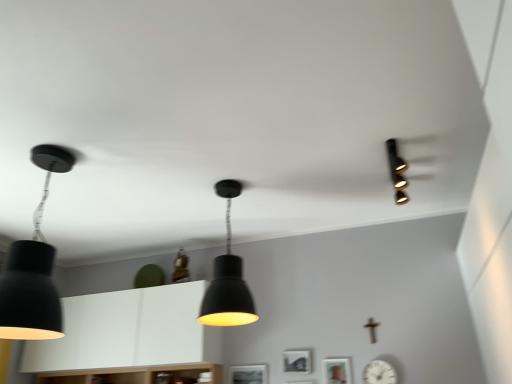
Question: Are matte black picture frame at center, the third picture frame in the right-to-left sequence, and matte black lampshade at center, which is the second lamp in right-to-left order, located far from each other?

Choices:
 (A) yes
 (B) no

Answer: (A)

Question: Is matte black picture frame at center, positioned as the 1th picture frame in left-to-right order, at the left side of matte black lampshade at center, acting as the second lamp starting from the left?

Choices:
 (A) no
 (B) yes

Answer: (A)

Question: Does matte black picture frame at center, positioned as the 1th picture frame in left-to-right order, have a greater width compared to matte black lampshade at center, acting as the second lamp starting from the left?

Choices:
 (A) yes
 (B) no

Answer: (B)

Question: Is matte black picture frame at center, the third picture frame in the right-to-left sequence, outside matte black lampshade at center, acting as the second lamp starting from the left?

Choices:
 (A) yes
 (B) no

Answer: (A)

Question: Is matte black picture frame at center, the third picture frame in the right-to-left sequence, facing away from matte black lampshade at center, acting as the second lamp starting from the left?

Choices:
 (A) yes
 (B) no

Answer: (B)

Question: From a real-world perspective, is matte black picture frame at center, the third picture frame in the right-to-left sequence, under matte black lampshade at center, which is the second lamp in right-to-left order?

Choices:
 (A) no
 (B) yes

Answer: (B)

Question: Is matte black picture frame at center, positioned as the 1th picture frame in left-to-right order, wider than white matte cabinet at center?

Choices:
 (A) yes
 (B) no

Answer: (B)

Question: Is matte black picture frame at center, positioned as the 1th picture frame in left-to-right order, oriented away from white matte cabinet at center?

Choices:
 (A) no
 (B) yes

Answer: (A)

Question: Is matte black picture frame at center, the third picture frame in the right-to-left sequence, thinner than white matte cabinet at center?

Choices:
 (A) no
 (B) yes

Answer: (B)

Question: Can you confirm if matte black picture frame at center, the third picture frame in the right-to-left sequence, is positioned to the left of white matte cabinet at center?

Choices:
 (A) yes
 (B) no

Answer: (B)

Question: Does matte black picture frame at center, positioned as the 1th picture frame in left-to-right order, touch white matte cabinet at center?

Choices:
 (A) yes
 (B) no

Answer: (B)

Question: From a real-world perspective, is matte black picture frame at center, the third picture frame in the right-to-left sequence, below white matte cabinet at center?

Choices:
 (A) yes
 (B) no

Answer: (A)

Question: Is matte black picture frame at center, the third picture frame in the right-to-left sequence, closer to the viewer compared to wooden picture frame at lower center, the 1th picture frame positioned from the right?

Choices:
 (A) yes
 (B) no

Answer: (B)